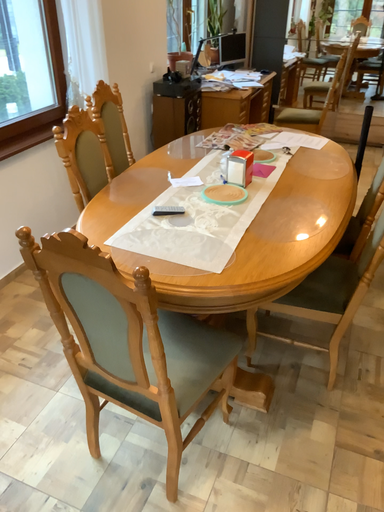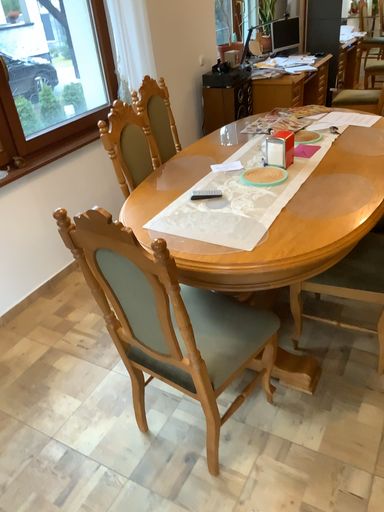
Question: How did the camera likely rotate when shooting the video?

Choices:
 (A) rotated left
 (B) rotated right

Answer: (A)